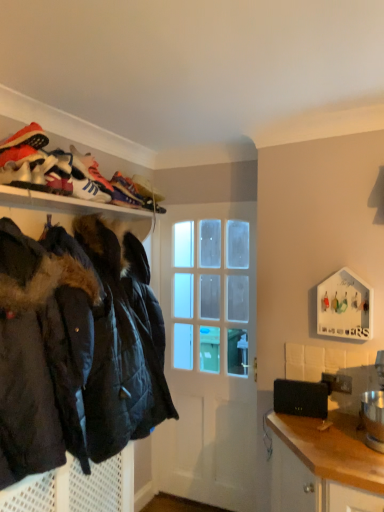
Question: Is white leather sneaker at upper left not near matte black jackets at upper left?

Choices:
 (A) no
 (B) yes

Answer: (A)

Question: Does white leather sneaker at upper left appear on the left side of matte black jackets at upper left?

Choices:
 (A) no
 (B) yes

Answer: (A)

Question: Does white leather sneaker at upper left appear on the right side of matte black jackets at upper left?

Choices:
 (A) yes
 (B) no

Answer: (A)

Question: Could you tell me if white leather sneaker at upper left is facing matte black jackets at upper left?

Choices:
 (A) no
 (B) yes

Answer: (A)

Question: Can you confirm if white leather sneaker at upper left is shorter than matte black jackets at upper left?

Choices:
 (A) yes
 (B) no

Answer: (A)

Question: Considering the relative sizes of white leather sneaker at upper left and matte black jackets at upper left in the image provided, is white leather sneaker at upper left smaller than matte black jackets at upper left?

Choices:
 (A) yes
 (B) no

Answer: (A)

Question: Is black quilted jacket at left to the right of white glossy door at center from the viewer's perspective?

Choices:
 (A) yes
 (B) no

Answer: (B)

Question: Is black quilted jacket at left not near white glossy door at center?

Choices:
 (A) yes
 (B) no

Answer: (B)

Question: From the image's perspective, does black quilted jacket at left appear higher than white glossy door at center?

Choices:
 (A) yes
 (B) no

Answer: (A)

Question: Considering the relative sizes of black quilted jacket at left and white glossy door at center in the image provided, is black quilted jacket at left bigger than white glossy door at center?

Choices:
 (A) no
 (B) yes

Answer: (B)

Question: From the image's perspective, is black quilted jacket at left beneath white glossy door at center?

Choices:
 (A) no
 (B) yes

Answer: (A)

Question: Is black quilted jacket at left surrounding white glossy door at center?

Choices:
 (A) no
 (B) yes

Answer: (A)

Question: Considering the relative positions of black matte laptop at lower right and black quilted jacket at left in the image provided, is black matte laptop at lower right to the right of black quilted jacket at left from the viewer's perspective?

Choices:
 (A) yes
 (B) no

Answer: (A)